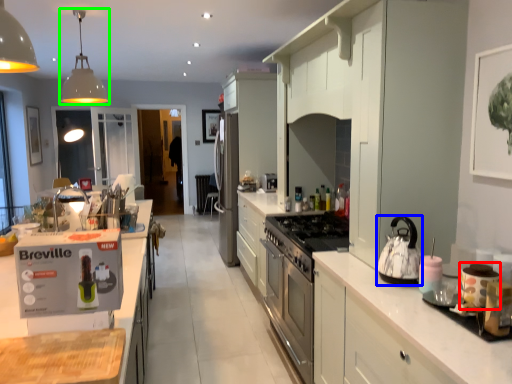
Question: Estimate the real-world distances between objects in this image. Which object is farther from appliance (highlighted by a red box), kitchen appliance (highlighted by a blue box) or light fixture (highlighted by a green box)?

Choices:
 (A) kitchen appliance
 (B) light fixture

Answer: (B)